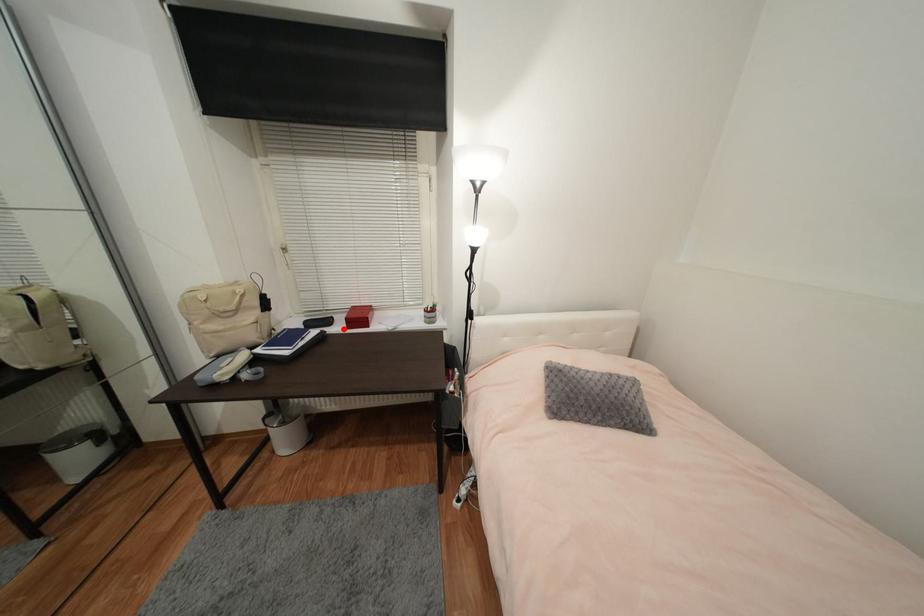
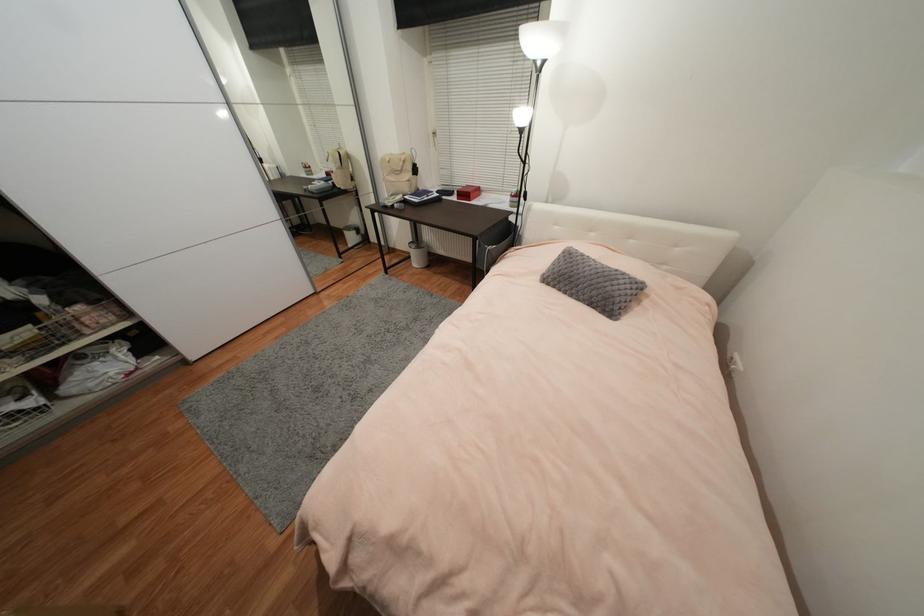
Question: I am providing you with two images of the same scene from different viewpoints. In image1, a red point is highlighted. Considering the same 3D point in image2, which of the following is correct?

Choices:
 (A) It is closer
 (B) It is farther

Answer: (A)